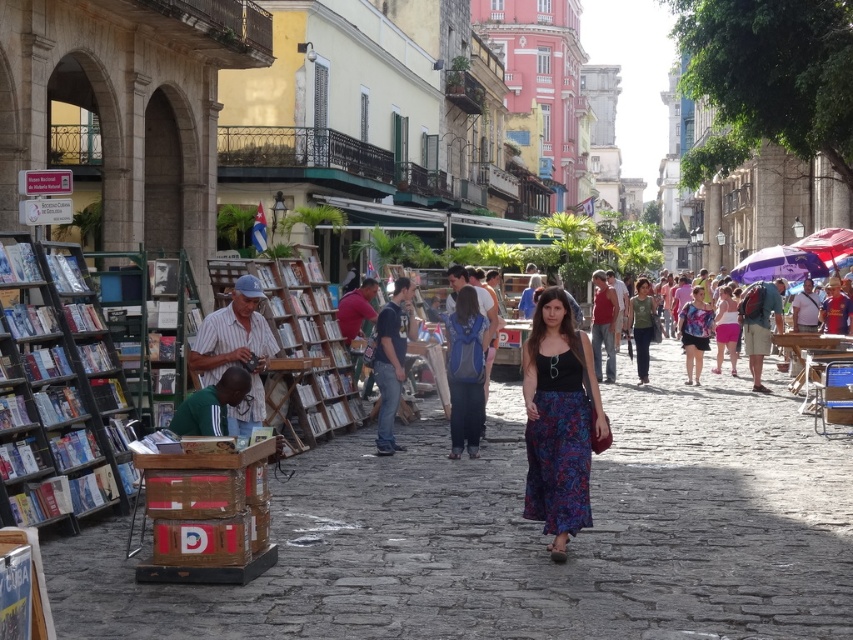
Question: Which point is farther to the camera?

Choices:
 (A) (90, 282)
 (B) (461, 445)
 (C) (544, 397)

Answer: (B)

Question: Is black cotton tank top at center above green cotton shirt at center?

Choices:
 (A) no
 (B) yes

Answer: (A)

Question: Can you confirm if metallic gray bookshelf at left is smaller than pink fabric skirt at center?

Choices:
 (A) yes
 (B) no

Answer: (B)

Question: Which point is closer to the camera?

Choices:
 (A) (564, 429)
 (B) (463, 433)
 (C) (86, 330)

Answer: (A)

Question: Can you confirm if metallic gray bookshelf at left is wider than wooden bookshelf at center?

Choices:
 (A) yes
 (B) no

Answer: (A)

Question: Which object is positioned closest to the striped fabric vendor at center?

Choices:
 (A) wooden bookshelf at center
 (B) black cotton tank top at center
 (C) pink fabric skirt at center
 (D) floral dress at center

Answer: (A)